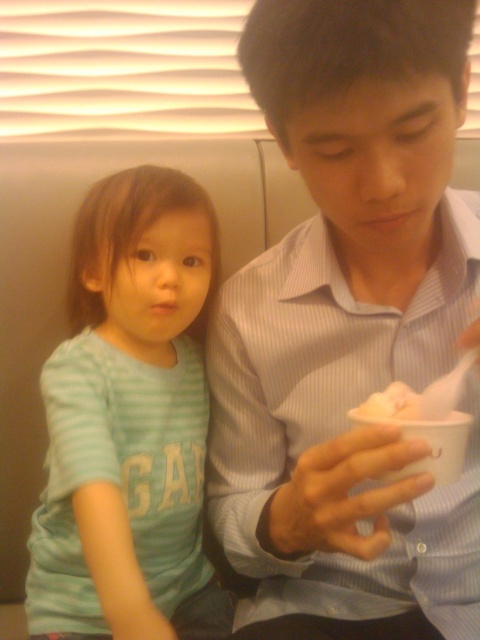
Does matte blue shirt at center have a lesser height compared to light blue striped shirt at left?

Indeed, matte blue shirt at center has a lesser height compared to light blue striped shirt at left.

Is matte blue shirt at center in front of light blue striped shirt at left?

Yes, it is.

What do you see at coordinates (350, 330) in the screenshot?
I see `matte blue shirt at center` at bounding box center [350, 330].

In order to click on matte blue shirt at center in this screenshot , I will do `click(350, 330)`.

Who is positioned more to the left, matte blue shirt at center or white paper food at center?

matte blue shirt at center

Does matte blue shirt at center have a lesser height compared to white paper food at center?

No.

Does point (393, 209) come in front of point (383, 406)?

No.

At what (x,y) coordinates should I click in order to perform the action: click on matte blue shirt at center. Please return your answer as a coordinate pair (x, y). Looking at the image, I should click on (350, 330).

Who is lower down, light blue striped shirt at left or white paper food at center?

light blue striped shirt at left is lower down.

Which is in front, point (193, 440) or point (411, 412)?

Point (411, 412) is more forward.

The height and width of the screenshot is (640, 480). Find the location of `light blue striped shirt at left`. light blue striped shirt at left is located at coordinates (129, 422).